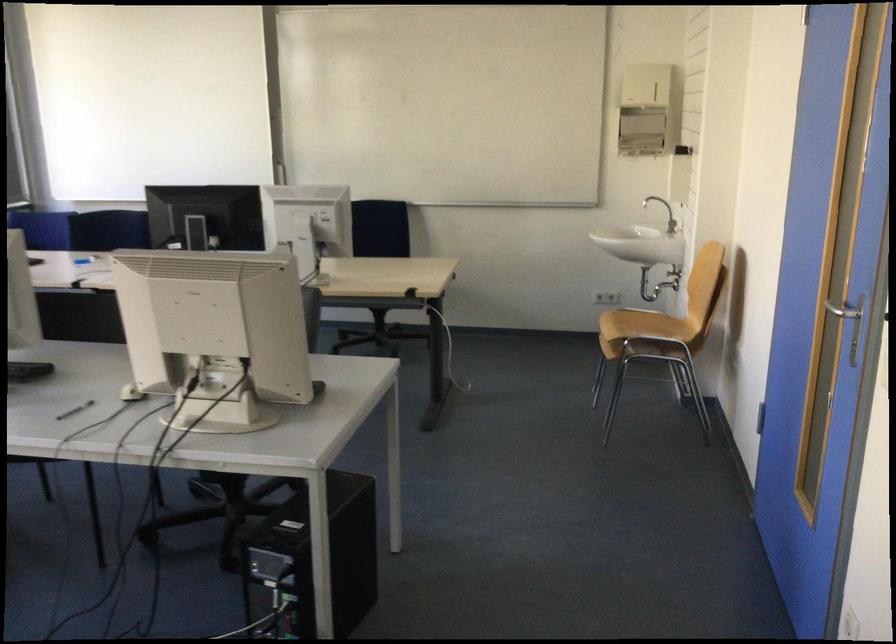
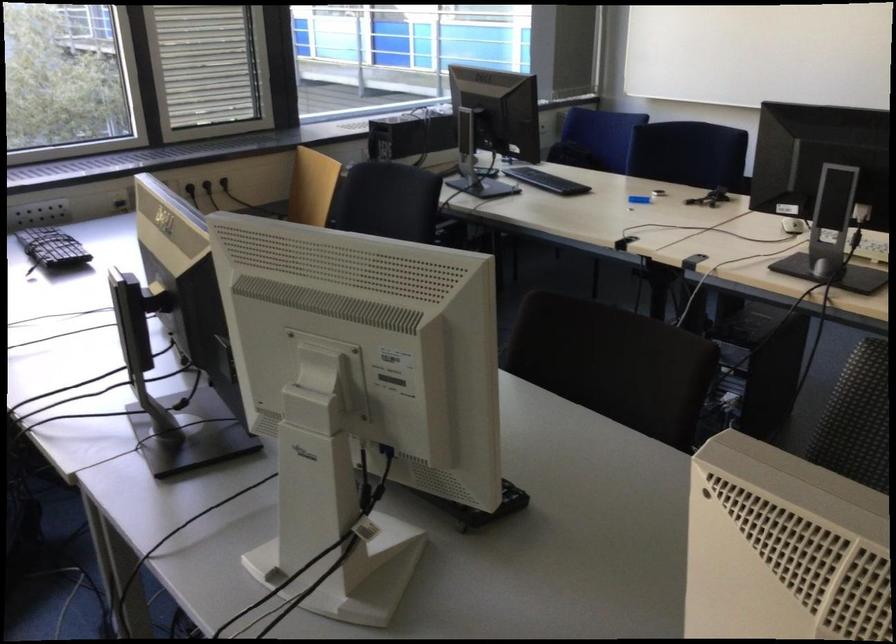
Where in the second image is the point corresponding to point 134,220 from the first image?

(687, 153)